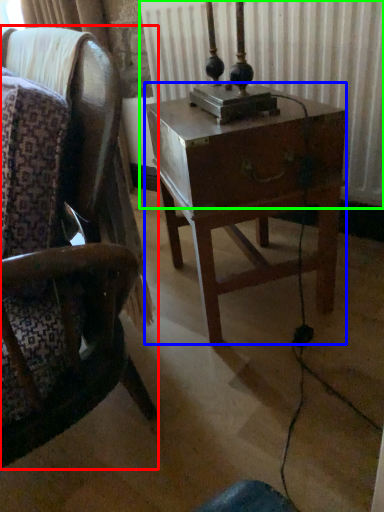
Question: Which is nearer to the chair (highlighted by a red box)? nightstand (highlighted by a blue box) or radiator (highlighted by a green box).

Choices:
 (A) nightstand
 (B) radiator

Answer: (A)